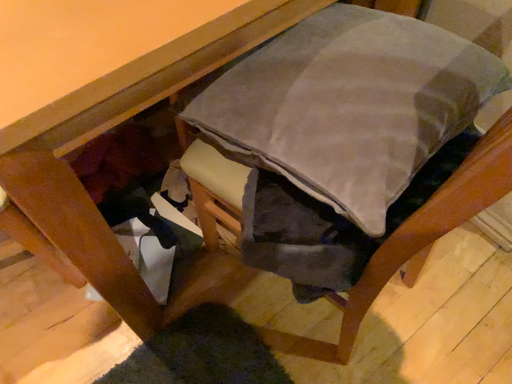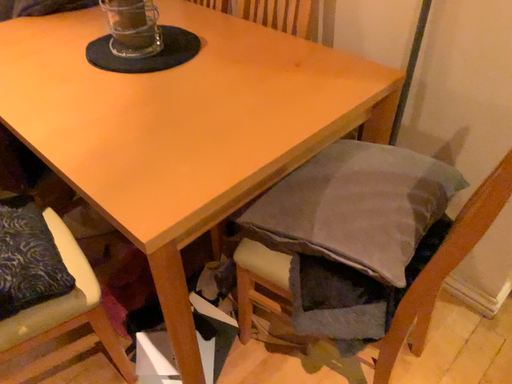
Question: Which way did the camera rotate in the video?

Choices:
 (A) rotated upward
 (B) rotated downward

Answer: (A)